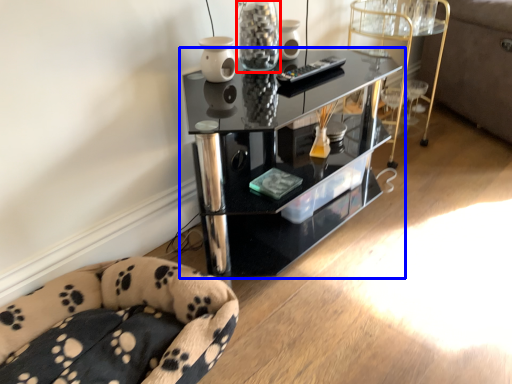
Question: Which of the following is the farthest to the observer, glass vase (highlighted by a red box) or shelf (highlighted by a blue box)?

Choices:
 (A) glass vase
 (B) shelf

Answer: (A)